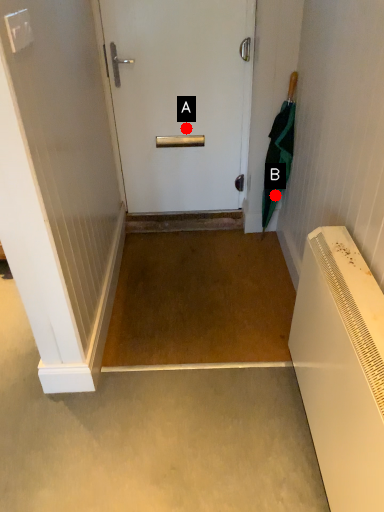
Question: Two points are circled on the image, labeled by A and B beside each circle. Which point appears closest to the camera in this image?

Choices:
 (A) A is closer
 (B) B is closer

Answer: (A)